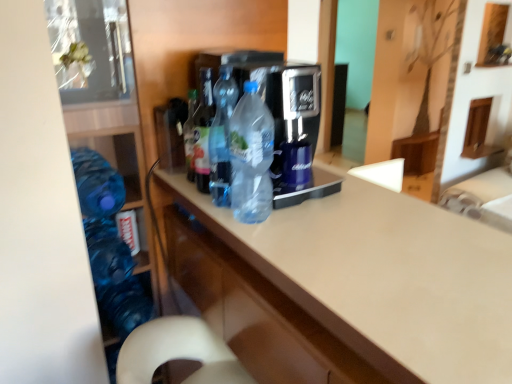
What are the coordinates of `vacant space in front of translucent plastic bottle at center, the 2th bottle viewed from the right` in the screenshot? It's located at (248, 231).